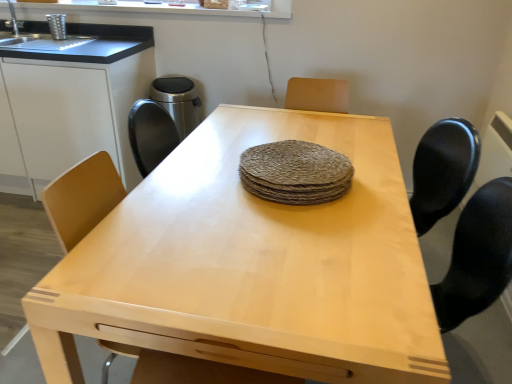
This screenshot has width=512, height=384. Find the location of `free space in front of rough woven placemat at center`. free space in front of rough woven placemat at center is located at coordinates (296, 241).